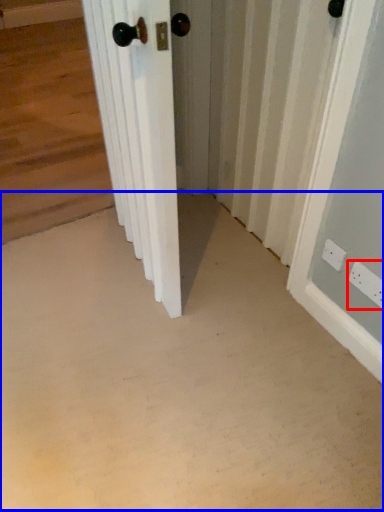
Question: Which object appears closest to the camera in this image, electric outlet (highlighted by a red box) or concrete (highlighted by a blue box)?

Choices:
 (A) electric outlet
 (B) concrete

Answer: (B)